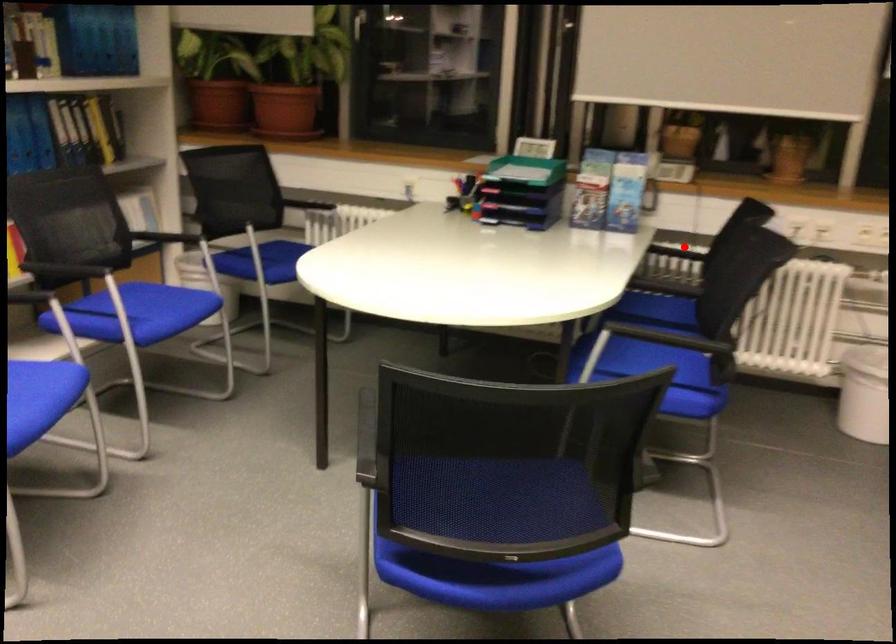
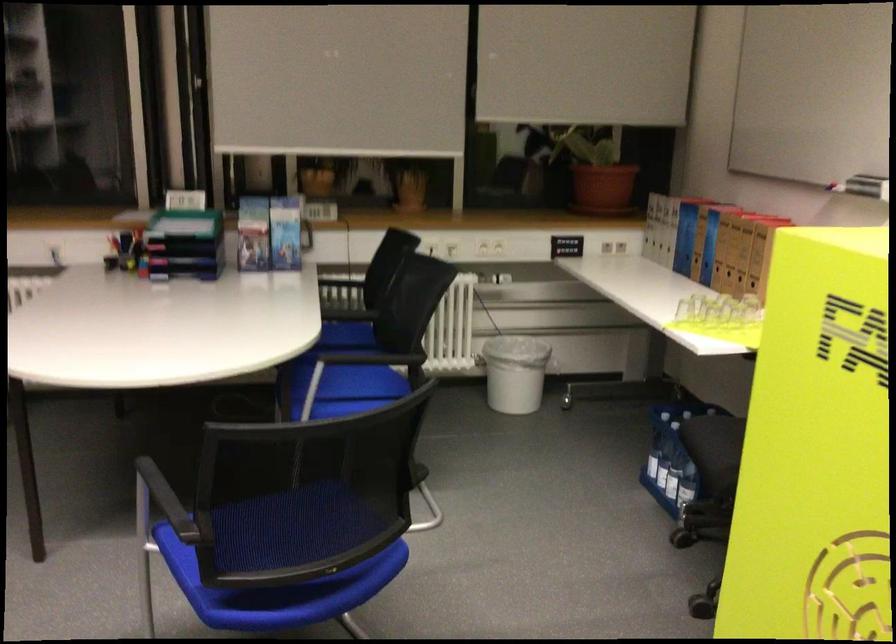
Question: I am providing you with two images of the same scene from different viewpoints. A red point is shown in image1. For the corresponding object point in image2, is it positioned nearer or farther from the camera?

Choices:
 (A) Nearer
 (B) Farther

Answer: (B)